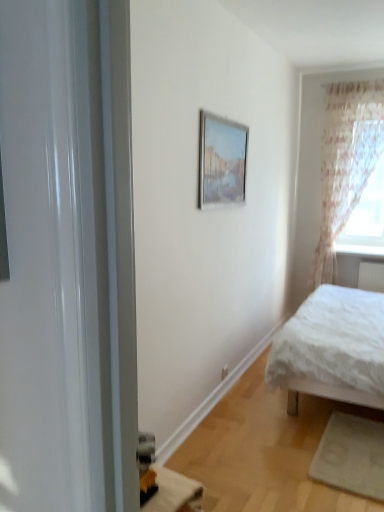
Question: Does white glossy window sill at upper right come behind sheer floral fabric at right?

Choices:
 (A) yes
 (B) no

Answer: (A)

Question: Can you confirm if white glossy window sill at upper right is smaller than sheer floral fabric at right?

Choices:
 (A) no
 (B) yes

Answer: (B)

Question: Considering the relative sizes of white glossy window sill at upper right and sheer floral fabric at right in the image provided, is white glossy window sill at upper right thinner than sheer floral fabric at right?

Choices:
 (A) yes
 (B) no

Answer: (B)

Question: Would you say white glossy window sill at upper right is outside sheer floral fabric at right?

Choices:
 (A) yes
 (B) no

Answer: (A)

Question: Considering the relative positions of white glossy window sill at upper right and sheer floral fabric at right in the image provided, is white glossy window sill at upper right in front of sheer floral fabric at right?

Choices:
 (A) no
 (B) yes

Answer: (A)

Question: Would you say white textured bed at right is to the left or to the right of translucent floral curtain at right in the picture?

Choices:
 (A) left
 (B) right

Answer: (A)

Question: Considering their positions, is white textured bed at right located in front of or behind translucent floral curtain at right?

Choices:
 (A) front
 (B) behind

Answer: (A)

Question: Based on their sizes in the image, would you say white textured bed at right is bigger or smaller than translucent floral curtain at right?

Choices:
 (A) big
 (B) small

Answer: (A)

Question: From a real-world perspective, relative to translucent floral curtain at right, is white textured bed at right vertically above or below?

Choices:
 (A) below
 (B) above

Answer: (A)

Question: Considering the positions of matte silver picture frame at upper center and white glossy window sill at upper right in the image, is matte silver picture frame at upper center wider or thinner than white glossy window sill at upper right?

Choices:
 (A) wide
 (B) thin

Answer: (B)

Question: From a real-world perspective, is matte silver picture frame at upper center positioned above or below white glossy window sill at upper right?

Choices:
 (A) above
 (B) below

Answer: (A)

Question: Looking at the image, does matte silver picture frame at upper center seem bigger or smaller compared to white glossy window sill at upper right?

Choices:
 (A) big
 (B) small

Answer: (A)

Question: From the image's perspective, is matte silver picture frame at upper center positioned above or below white glossy window sill at upper right?

Choices:
 (A) below
 (B) above

Answer: (B)

Question: Is point (336, 172) positioned closer to the camera than point (201, 123)?

Choices:
 (A) farther
 (B) closer

Answer: (A)

Question: Is sheer floral fabric at right wider or thinner than matte silver picture frame at upper center?

Choices:
 (A) thin
 (B) wide

Answer: (B)